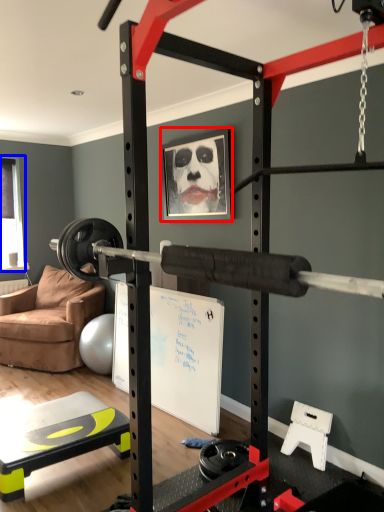
Question: Which object appears farthest to the camera in this image, picture frame (highlighted by a red box) or window screen (highlighted by a blue box)?

Choices:
 (A) picture frame
 (B) window screen

Answer: (B)